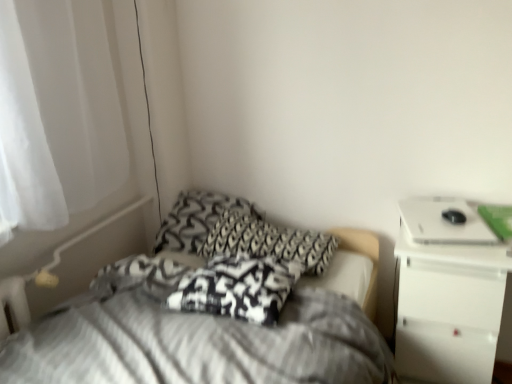
Where is `free space above white glossy laptop at upper right (from a real-world perspective)`? Image resolution: width=512 pixels, height=384 pixels. free space above white glossy laptop at upper right (from a real-world perspective) is located at coordinates (433, 216).